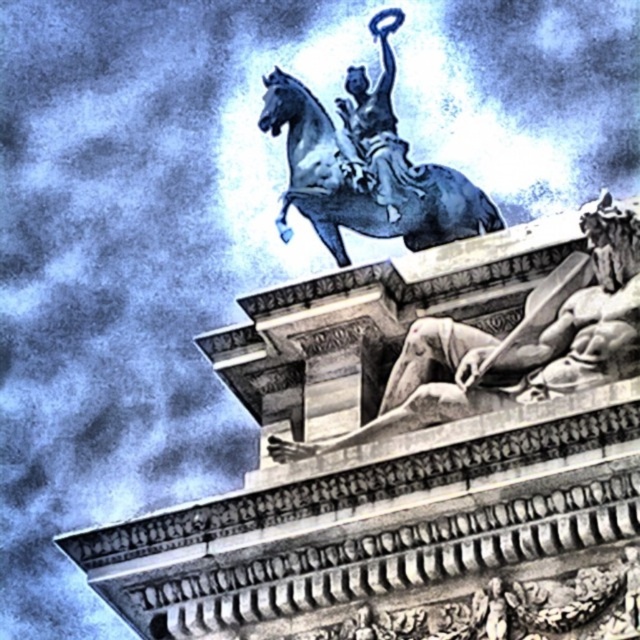
Based on the scene description, where is the smooth stone reclining figure at center located in terms of its 2D coordinates?

The smooth stone reclining figure at center is located at coordinates point (x=515, y=342).

In the scene shown: You are an art student analyzing the sculpture. You notice the smooth stone reclining figure at center and the shiny blue horse at center. Which one is smaller in size?

The smooth stone reclining figure at center is smaller in size compared to the shiny blue horse at center.